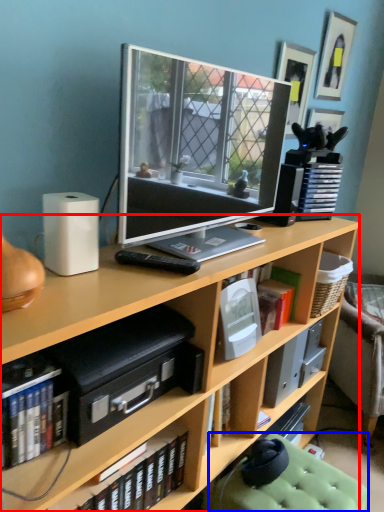
Question: Among these objects, which one is farthest to the camera, bookcase (highlighted by a red box) or swivel chair (highlighted by a blue box)?

Choices:
 (A) bookcase
 (B) swivel chair

Answer: (B)